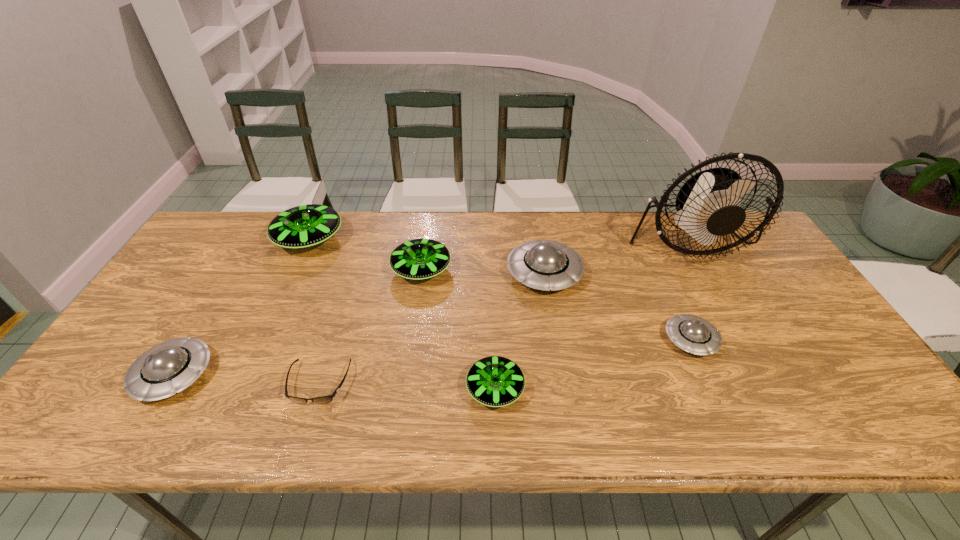
Locate an element on the screen. This screenshot has width=960, height=540. vacant space that is in between the leftmost gray saucer and the fan is located at coordinates (430, 308).

Find the location of a particular element. vacant region between the second smallest gray saucer and the leftmost green saucer is located at coordinates (242, 307).

Where is `unoccupied area between the biggest green saucer and the second biggest green saucer`? The image size is (960, 540). unoccupied area between the biggest green saucer and the second biggest green saucer is located at coordinates (366, 255).

Find the location of a particular element. The height and width of the screenshot is (540, 960). object that is the fifth closest to the tallest object is located at coordinates (324, 399).

Find the location of a particular element. This screenshot has width=960, height=540. object that is the closest to the shortest object is located at coordinates 168,368.

What are the coordinates of `saucer that stands as the second closest to the leftmost green saucer` in the screenshot? It's located at (168, 368).

Identify which saucer is the fourth nearest to the smallest gray saucer. Please provide its 2D coordinates. Your answer should be formatted as a tuple, i.e. [(x, y)], where the tuple contains the x and y coordinates of a point satisfying the conditions above.

[(304, 226)]

Where is `green saucer that is the closest one to the smallest green saucer`? Image resolution: width=960 pixels, height=540 pixels. green saucer that is the closest one to the smallest green saucer is located at coordinates click(418, 259).

You are a GUI agent. You are given a task and a screenshot of the screen. Output one action in this format:
    pyautogui.click(x=<x>, y=<y>)
    Task: Click on the second closest green saucer to the second smallest gray saucer
    This screenshot has height=540, width=960.
    Given the screenshot: What is the action you would take?
    pyautogui.click(x=418, y=259)

I want to click on gray saucer that can be found as the closest to the rightmost gray saucer, so (x=546, y=265).